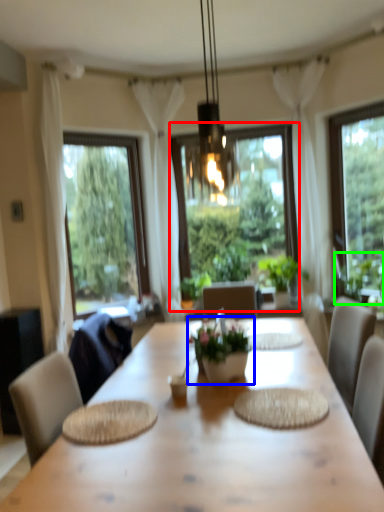
Question: Estimate the real-world distances between objects in this image. Which object is farther from window (highlighted by a red box), houseplant (highlighted by a blue box) or plant (highlighted by a green box)?

Choices:
 (A) houseplant
 (B) plant

Answer: (A)